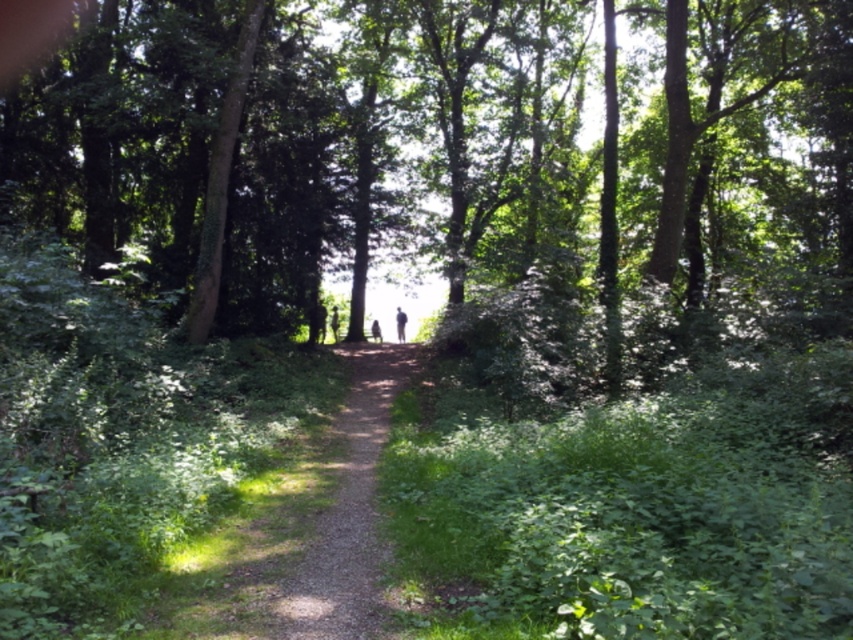
You are a hiker standing at the point with coordinates (x=296, y=531) in the forest. Which object is directly beneath your feet?

The dirt path at center is located at point (x=296, y=531), so the object directly beneath your feet is the dirt path at center.

You are a hiker standing at the start of the forest path. You see a point marked at coordinates (331, 332) in the scene. If your hiking backpack has a GPS that can only track objects within 40 meters, will you be able to track that point with your GPS?

The point at (331, 332) is 41.89 meters away from you, which is beyond the 40 meter range of your GPS. Therefore, you won cannot track that point with your GPS.